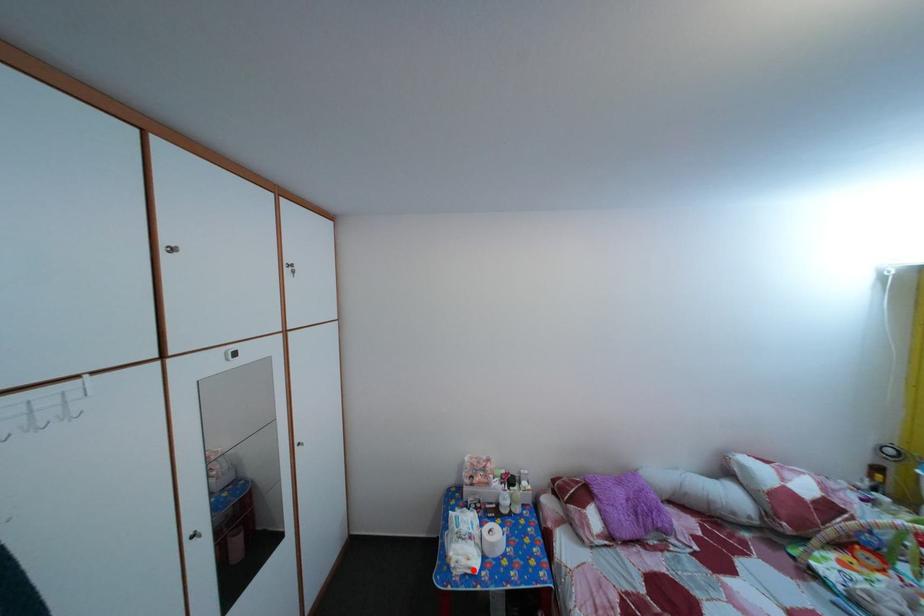
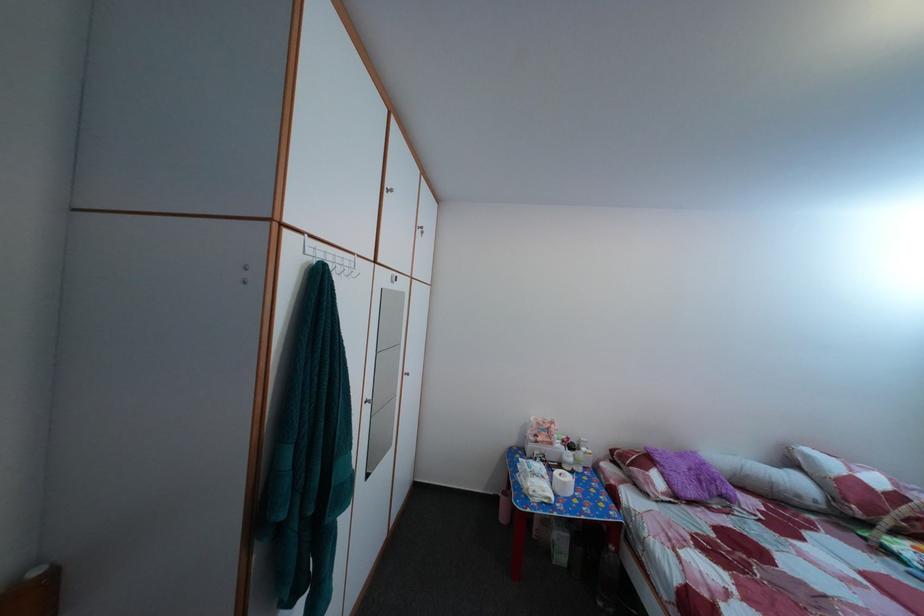
In the second image, find the point that corresponds to the highlighted location in the first image.

(551, 500)